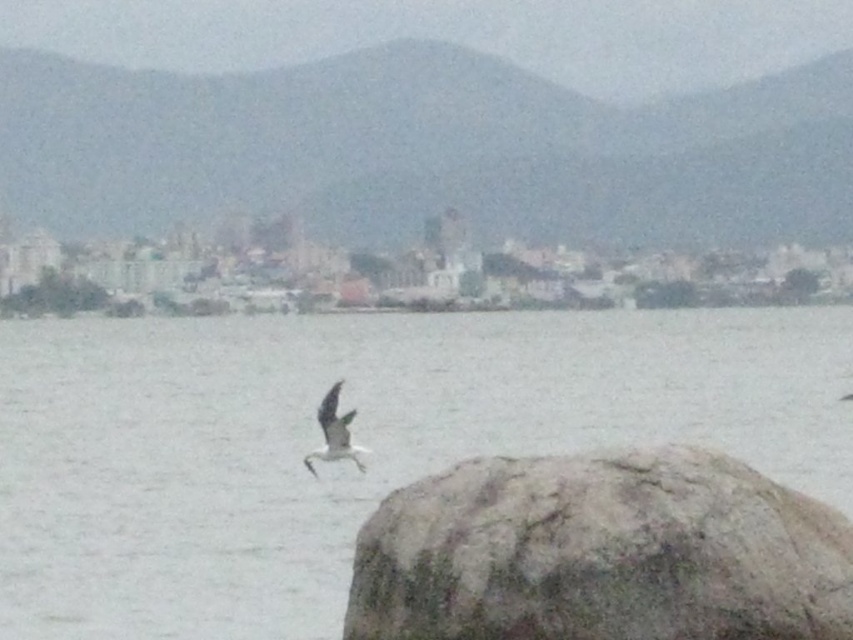
Question: Which object appears closest to the camera in this image?

Choices:
 (A) white feathered bird at center
 (B) gray rough rock at lower right
 (C) gray matte water at center

Answer: (B)

Question: Is gray matte water at center positioned at the back of white feathered bird at center?

Choices:
 (A) no
 (B) yes

Answer: (A)

Question: Which is nearer to the gray rough rock at lower right?

Choices:
 (A) white feathered bird at center
 (B) gray matte water at center

Answer: (A)

Question: From the image, what is the correct spatial relationship of gray matte water at center in relation to gray rough rock at lower right?

Choices:
 (A) above
 (B) below

Answer: (A)

Question: Can you confirm if gray matte water at center is positioned below white feathered bird at center?

Choices:
 (A) no
 (B) yes

Answer: (A)

Question: Which object is positioned closest to the white feathered bird at center?

Choices:
 (A) gray rough rock at lower right
 (B) gray matte water at center

Answer: (A)